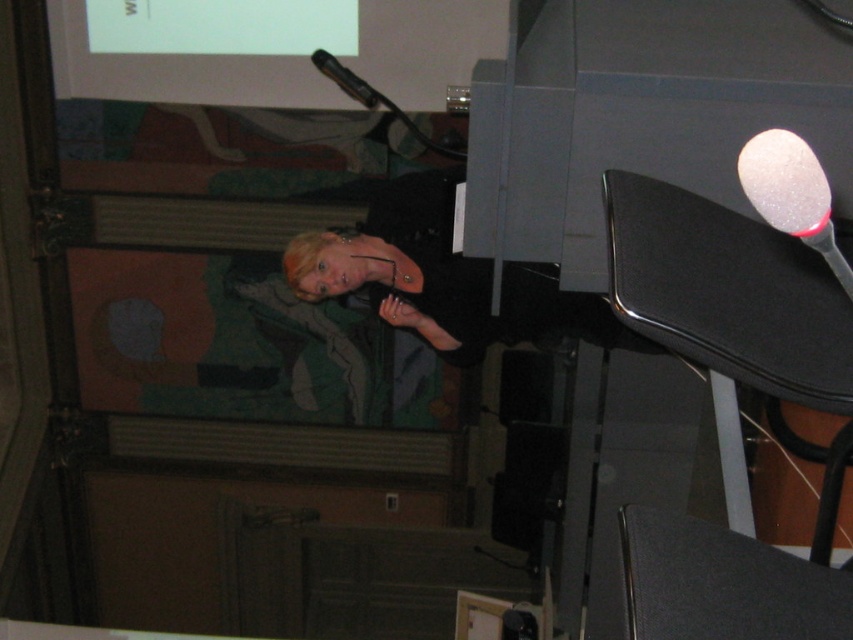
Question: Among these points, which one is farthest from the camera?

Choices:
 (A) (764, 150)
 (B) (351, 83)

Answer: (B)

Question: Which point is closer to the camera?

Choices:
 (A) sparkly white spoon at upper right
 (B) black plastic microphone at upper center
 (C) matte black dress at center

Answer: (A)

Question: Is matte black dress at center to the left of black plastic microphone at upper center from the viewer's perspective?

Choices:
 (A) yes
 (B) no

Answer: (B)

Question: Which of the following is the farthest from the observer?

Choices:
 (A) (335, 84)
 (B) (430, 188)
 (C) (792, 228)

Answer: (A)

Question: Is sparkly white spoon at upper right wider than black plastic microphone at upper center?

Choices:
 (A) no
 (B) yes

Answer: (A)

Question: Can you confirm if sparkly white spoon at upper right is thinner than black plastic microphone at upper center?

Choices:
 (A) no
 (B) yes

Answer: (B)